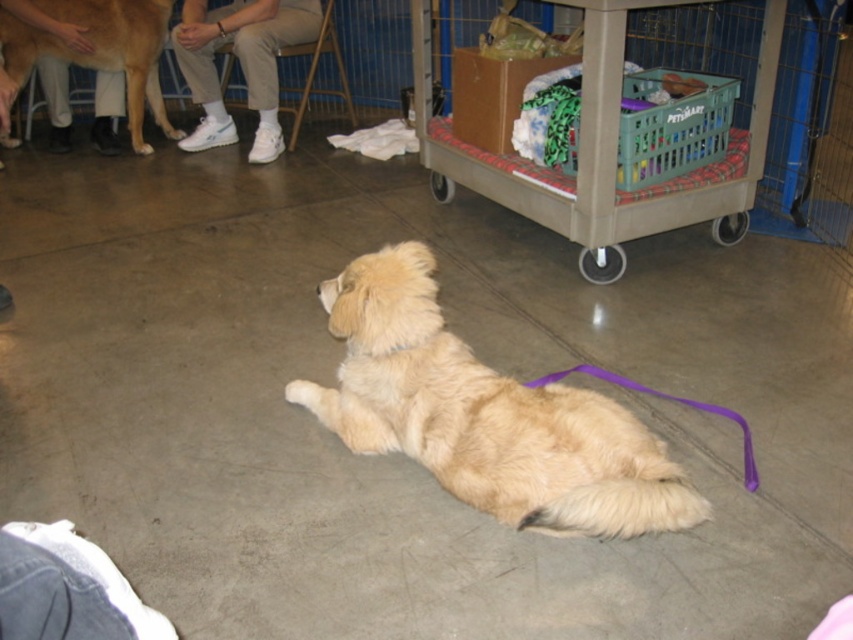
Who is more forward, (320, 419) or (140, 148)?

Point (320, 419) is in front.

Which is below, golden fur dog at center or golden fur dog at upper left?

golden fur dog at center

Describe the element at coordinates (485, 413) in the screenshot. This screenshot has height=640, width=853. I see `golden fur dog at center` at that location.

Identify the location of golden fur dog at center. The width and height of the screenshot is (853, 640). (485, 413).

Between point (274, 108) and point (126, 8), which one is positioned behind?

The point (274, 108) is behind.

Does white fabric pants at upper left lie behind golden fur dog at upper left?

No, white fabric pants at upper left is in front of golden fur dog at upper left.

Which is in front, point (178, 60) or point (148, 76)?

Positioned in front is point (178, 60).

This screenshot has height=640, width=853. In order to click on white fabric pants at upper left in this screenshot , I will do `click(241, 65)`.

Between point (316, 413) and point (218, 113), which one is positioned behind?

The point (218, 113) is behind.

Can you confirm if golden fur dog at center is smaller than white fabric pants at upper left?

Correct, golden fur dog at center occupies less space than white fabric pants at upper left.

What do you see at coordinates (485, 413) in the screenshot? I see `golden fur dog at center` at bounding box center [485, 413].

Image resolution: width=853 pixels, height=640 pixels. I want to click on golden fur dog at center, so click(485, 413).